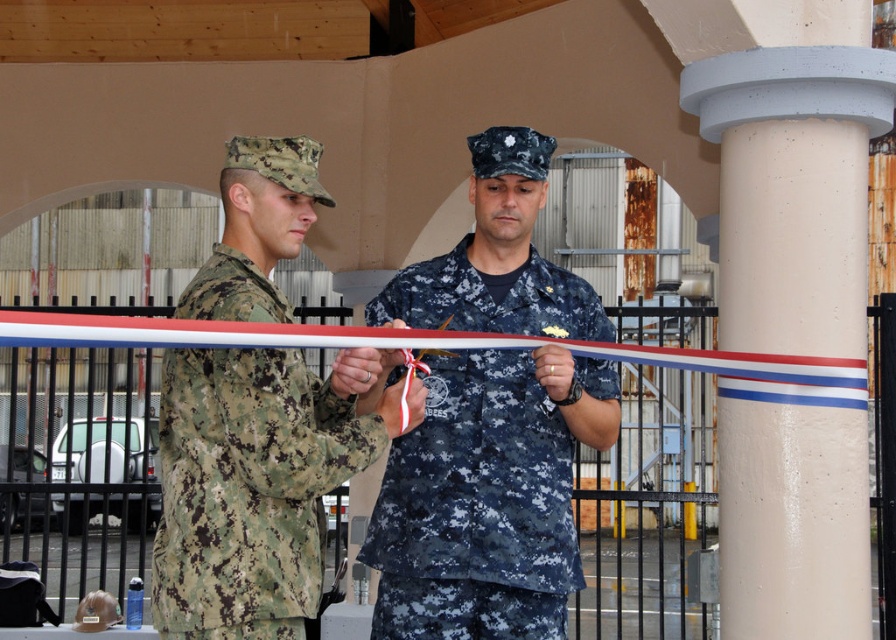
Does white concrete pillar at center appear under navy blue camouflage uniform at center?

Actually, white concrete pillar at center is above navy blue camouflage uniform at center.

What are the coordinates of `white concrete pillar at center` in the screenshot? It's located at (786, 161).

Is navy blue camouflage uniform at center in front of camouflage fabric uniform at left?

That is False.

Does navy blue camouflage uniform at center appear on the left side of camouflage fabric uniform at left?

In fact, navy blue camouflage uniform at center is to the right of camouflage fabric uniform at left.

Is point (464, 509) closer to camera compared to point (239, 364)?

No, it is behind (239, 364).

Locate an element on the screen. This screenshot has height=640, width=896. navy blue camouflage uniform at center is located at coordinates [481, 502].

Is point (742, 227) in front of point (174, 576)?

No, it is not.

Looking at this image, is white concrete pillar at center positioned at the back of camouflage fabric uniform at left?

That is True.

Is point (849, 10) positioned before point (208, 353)?

No, (849, 10) is further to viewer.

Image resolution: width=896 pixels, height=640 pixels. Find the location of `white concrete pillar at center`. white concrete pillar at center is located at coordinates (786, 161).